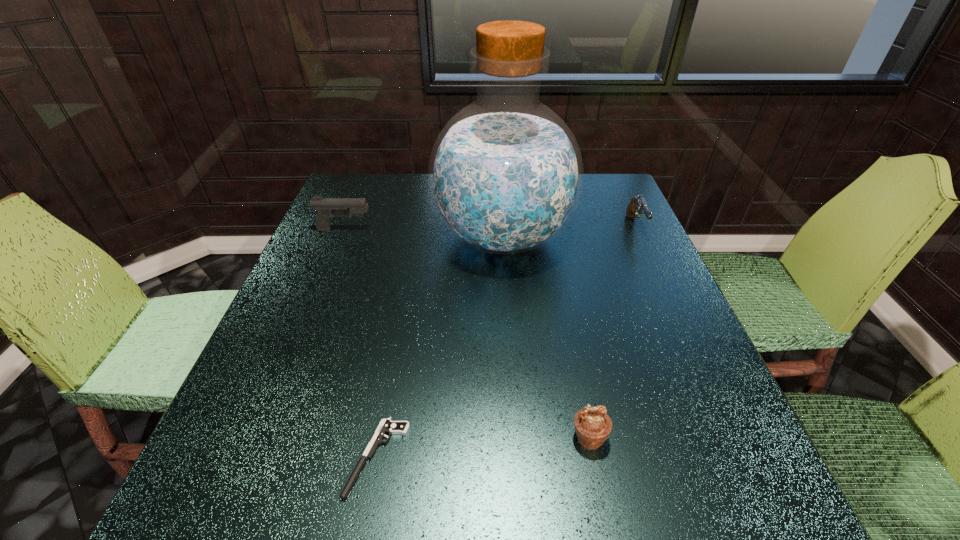
Image resolution: width=960 pixels, height=540 pixels. I want to click on free spot between the muffin and the second pistol from left to right, so click(483, 448).

At what (x,y) coordinates should I click in order to perform the action: click on free area in between the shortest object and the leftmost pistol. Please return your answer as a coordinate pair (x, y). The height and width of the screenshot is (540, 960). Looking at the image, I should click on (361, 344).

Locate an element on the screen. The width and height of the screenshot is (960, 540). free space between the muffin and the water jug is located at coordinates (545, 338).

Image resolution: width=960 pixels, height=540 pixels. What are the coordinates of `object that is the third closest to the tallest object` in the screenshot? It's located at (387, 426).

Locate which object is the fourth closest to the muffin. Please provide its 2D coordinates. Your answer should be formatted as a tuple, i.e. [(x, y)], where the tuple contains the x and y coordinates of a point satisfying the conditions above.

[(326, 207)]

Select which pistol is the second closest to the leftmost pistol. Please provide its 2D coordinates. Your answer should be formatted as a tuple, i.e. [(x, y)], where the tuple contains the x and y coordinates of a point satisfying the conditions above.

[(638, 204)]

Where is `the closest pistol relative to the muffin`? This screenshot has width=960, height=540. the closest pistol relative to the muffin is located at coordinates (387, 426).

You are a GUI agent. You are given a task and a screenshot of the screen. Output one action in this format:
    pyautogui.click(x=<x>, y=<y>)
    Task: Click on the vacant space that satisfies the following two spatial constraints: 1. on the front side of the muffin; 2. on the left side of the tallest object
    
    Given the screenshot: What is the action you would take?
    pyautogui.click(x=516, y=438)

At what (x,y) coordinates should I click in order to perform the action: click on free space in the image that satisfies the following two spatial constraints: 1. at the barrel of the leftmost pistol; 2. on the right side of the muffin. Please return your answer as a coordinate pair (x, y). Looking at the image, I should click on point(261,438).

Where is `free location that satisfies the following two spatial constraints: 1. at the barrel of the rightmost object; 2. on the front-facing side of the nearest pistol`? free location that satisfies the following two spatial constraints: 1. at the barrel of the rightmost object; 2. on the front-facing side of the nearest pistol is located at coordinates (742, 457).